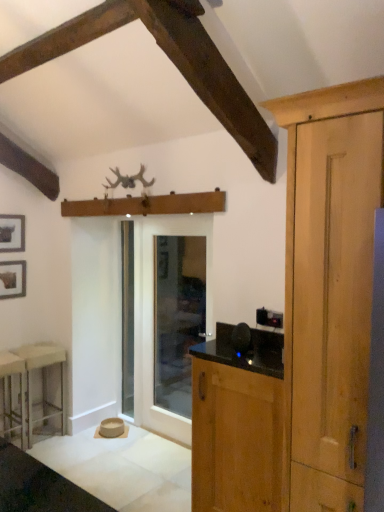
Image resolution: width=384 pixels, height=512 pixels. Identify the location of vacant space situated above white plastic stool at left, the 1th stool positioned from the back (from a real-world perspective). (39, 349).